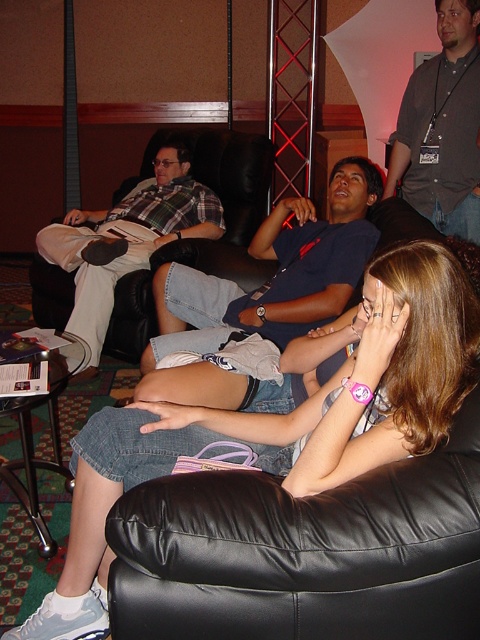
Question: Which point appears farthest from the camera in this image?

Choices:
 (A) (99, 282)
 (B) (85, 564)
 (C) (312, 272)
 (D) (454, 230)

Answer: (A)

Question: Which point appears closest to the camera in this image?

Choices:
 (A) (336, 260)
 (B) (435, 81)

Answer: (A)

Question: Among these points, which one is nearest to the camera?

Choices:
 (A) (344, 378)
 (B) (406, 96)
 (C) (360, 208)
 (D) (144, 220)

Answer: (A)

Question: Is dark gray shirt at upper right bigger than plaid fabric shirt at left?

Choices:
 (A) no
 (B) yes

Answer: (A)

Question: Can you confirm if dark blue t-shirt at center is wider than plaid fabric shirt at left?

Choices:
 (A) yes
 (B) no

Answer: (B)

Question: Can you confirm if denim skirt at lower left is positioned to the left of dark gray shirt at upper right?

Choices:
 (A) no
 (B) yes

Answer: (B)